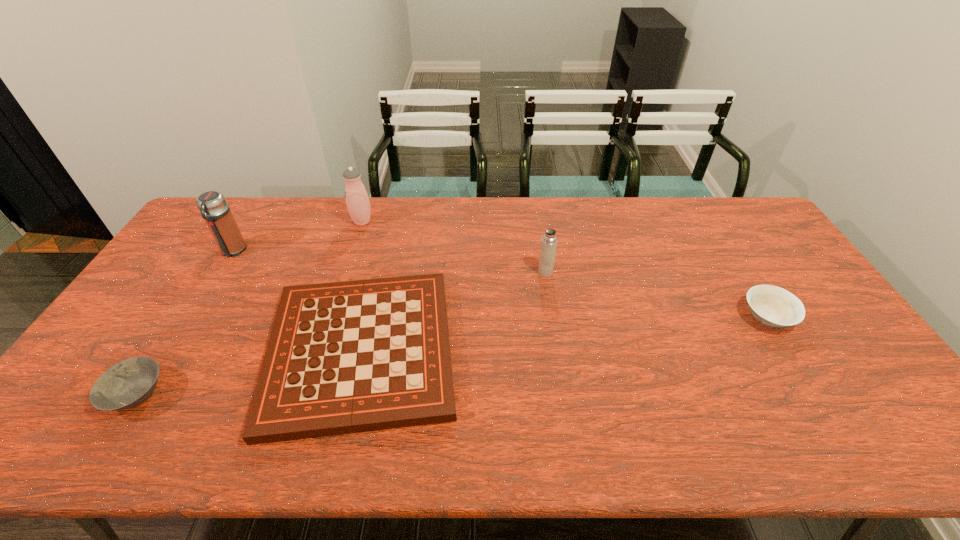
Identify the location of free point between the fifth object from left to right and the gameboard. The width and height of the screenshot is (960, 540). (453, 312).

Identify the location of empty space between the gameboard and the rightmost thermos bottle. (453, 312).

You are a GUI agent. You are given a task and a screenshot of the screen. Output one action in this format:
    pyautogui.click(x=<x>, y=<y>)
    Task: Click on the vacant region between the gameboard and the right bowl
    Image resolution: width=960 pixels, height=540 pixels.
    Given the screenshot: What is the action you would take?
    pyautogui.click(x=564, y=334)

Where is `unoccupied area between the farthest object and the second nearest thermos bottle`? unoccupied area between the farthest object and the second nearest thermos bottle is located at coordinates (298, 236).

What are the coordinates of `vacant area that lies between the gameboard and the right bowl` in the screenshot? It's located at (564, 334).

Where is `object that ranks as the closest to the left bowl`? The height and width of the screenshot is (540, 960). object that ranks as the closest to the left bowl is located at coordinates (345, 357).

The width and height of the screenshot is (960, 540). I want to click on object that ranks as the fifth closest to the farthest thermos bottle, so click(773, 306).

Select which thermos bottle is the closest to the farther bowl. Please provide its 2D coordinates. Your answer should be formatted as a tuple, i.e. [(x, y)], where the tuple contains the x and y coordinates of a point satisfying the conditions above.

[(549, 241)]

What are the coordinates of `thermos bottle that can be found as the second closest to the left bowl` in the screenshot? It's located at (357, 200).

Where is `free space in the image that satisfies the following two spatial constraints: 1. with a handle on the side of the second farthest object; 2. on the left side of the gameboard`? The image size is (960, 540). free space in the image that satisfies the following two spatial constraints: 1. with a handle on the side of the second farthest object; 2. on the left side of the gameboard is located at coordinates 171,350.